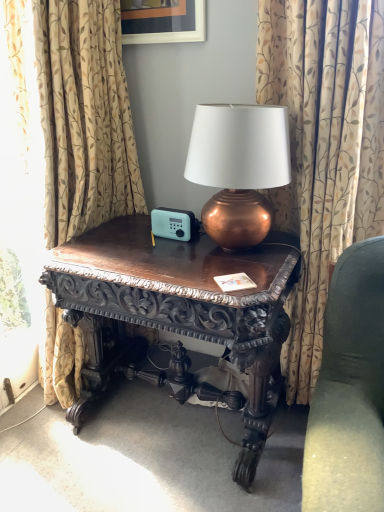
In order to click on free space in front of copper metallic lamp at center in this screenshot , I will do `click(228, 276)`.